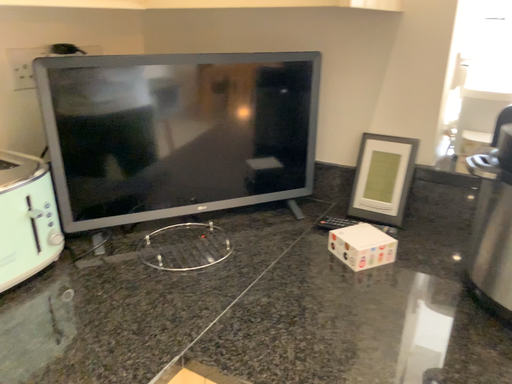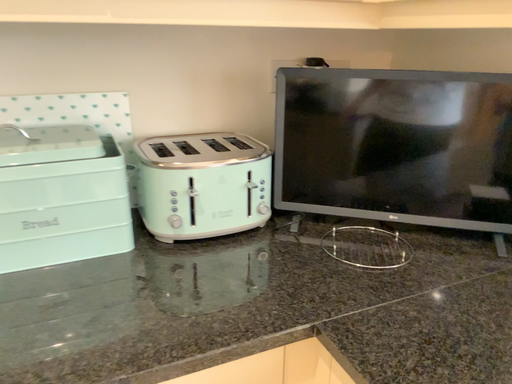
Question: How did the camera likely rotate when shooting the video?

Choices:
 (A) rotated upward
 (B) rotated downward

Answer: (A)